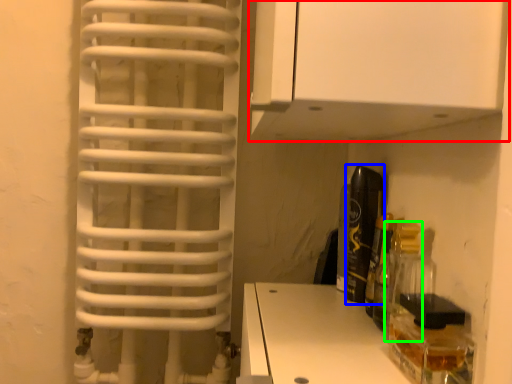
Question: Considering the real-world distances, which object is closest to cabinetry (highlighted by a red box)? bottle (highlighted by a blue box) or bottle (highlighted by a green box).

Choices:
 (A) bottle
 (B) bottle

Answer: (A)